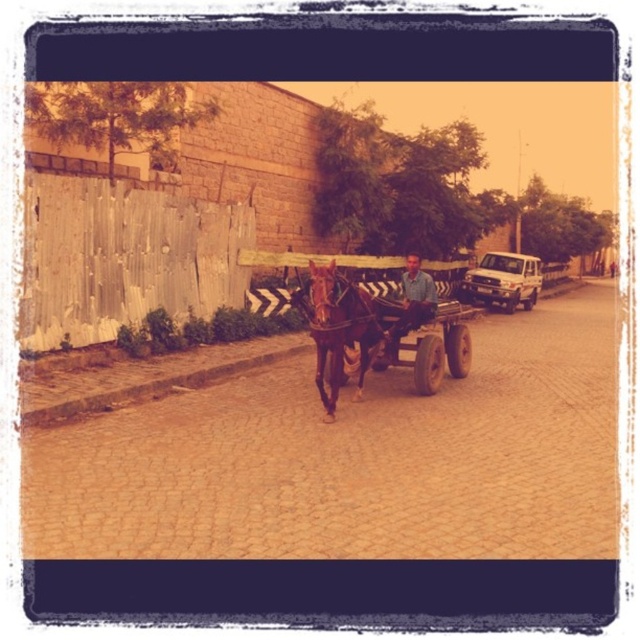
You are a pedestrian standing on the street and want to cross to the other side. There is a white matte truck at right and a matte blue shirt at center. Which object is closer to you as you decide to cross?

The white matte truck at right is closer to you than the matte blue shirt at center because it is further to the viewer.

You are a delivery person who needs to navigate a narrow alley that is only 1.5 meters wide. You see the brown wooden cart at center and the brown glossy horse at center in the street. Which one of these has a width that would allow it to pass through the alley without issue?

The brown wooden cart at center has a lesser width compared to brown glossy horse at center, so the brown wooden cart at center can pass through the 1.5 meter wide alley more easily than the brown glossy horse at center.

You are standing on the cobblestone street and see the brown wooden cart at center and the matte blue shirt at center. Which object is located to the right of the other?

The brown wooden cart at center is positioned on the left side of matte blue shirt at center, so the matte blue shirt at center is to the right of the brown wooden cart at center.